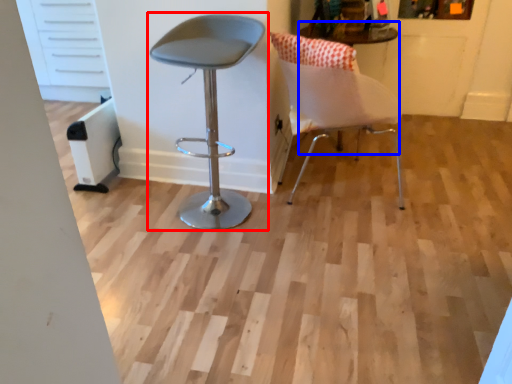
Question: Which of the following is the closest to the observer, chair (highlighted by a red box) or round table (highlighted by a blue box)?

Choices:
 (A) chair
 (B) round table

Answer: (A)